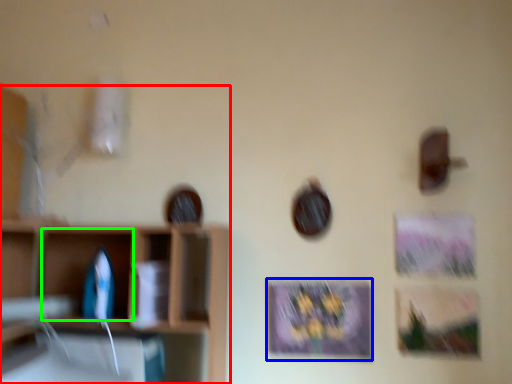
Question: Which is farther away from shelf (highlighted by a red box)? picture frame (highlighted by a blue box) or cabinet (highlighted by a green box)?

Choices:
 (A) picture frame
 (B) cabinet

Answer: (A)